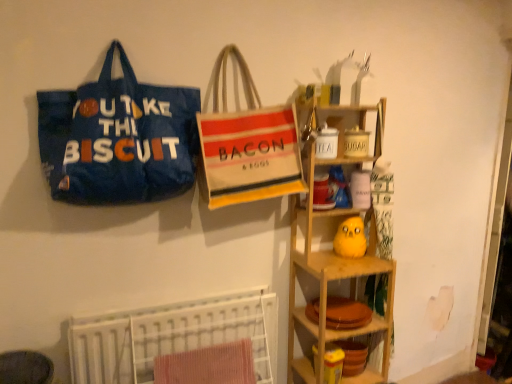
Question: Does wooden shelf at right, which is the first shelf from top to bottom, have a greater width compared to red textured towel at lower center?

Choices:
 (A) no
 (B) yes

Answer: (B)

Question: Would you say wooden shelf at right, which is the first shelf from top to bottom, contains red textured towel at lower center?

Choices:
 (A) yes
 (B) no

Answer: (B)

Question: Does wooden shelf at right, arranged as the 2th shelf when ordered from the bottom, have a smaller size compared to red textured towel at lower center?

Choices:
 (A) yes
 (B) no

Answer: (B)

Question: Does wooden shelf at right, which is the first shelf from top to bottom, touch red textured towel at lower center?

Choices:
 (A) no
 (B) yes

Answer: (A)

Question: Considering the relative positions of wooden shelf at right, which is the first shelf from top to bottom, and red textured towel at lower center in the image provided, is wooden shelf at right, which is the first shelf from top to bottom, to the right of red textured towel at lower center from the viewer's perspective?

Choices:
 (A) yes
 (B) no

Answer: (A)

Question: Can you confirm if wooden shelf at right, which is the first shelf from top to bottom, is bigger than red textured towel at lower center?

Choices:
 (A) yes
 (B) no

Answer: (A)

Question: Considering the relative sizes of wooden plate at lower center, the 2th shelf in the top-to-bottom sequence, and beige canvas tote bag at center, positioned as the second handbag in left-to-right order, in the image provided, is wooden plate at lower center, the 2th shelf in the top-to-bottom sequence, bigger than beige canvas tote bag at center, positioned as the second handbag in left-to-right order,?

Choices:
 (A) yes
 (B) no

Answer: (B)

Question: Could you tell me if wooden plate at lower center, the first shelf when ordered from bottom to top, is turned towards beige canvas tote bag at center, acting as the 1th handbag starting from the right?

Choices:
 (A) yes
 (B) no

Answer: (B)

Question: From the image's perspective, is wooden plate at lower center, the 2th shelf in the top-to-bottom sequence, on top of beige canvas tote bag at center, acting as the 1th handbag starting from the right?

Choices:
 (A) yes
 (B) no

Answer: (B)

Question: Could beige canvas tote bag at center, acting as the 1th handbag starting from the right, be considered to be inside wooden plate at lower center, the first shelf when ordered from bottom to top?

Choices:
 (A) no
 (B) yes

Answer: (A)

Question: Is wooden plate at lower center, the first shelf when ordered from bottom to top, touching beige canvas tote bag at center, positioned as the second handbag in left-to-right order?

Choices:
 (A) yes
 (B) no

Answer: (B)

Question: From a real-world perspective, does wooden plate at lower center, the first shelf when ordered from bottom to top, stand above beige canvas tote bag at center, acting as the 1th handbag starting from the right?

Choices:
 (A) yes
 (B) no

Answer: (B)

Question: From a real-world perspective, does red textured towel at lower center sit lower than blue fabric tote bag at left, the 2th handbag viewed from the right?

Choices:
 (A) yes
 (B) no

Answer: (A)